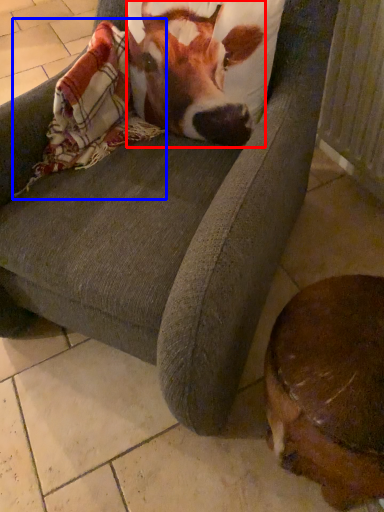
Question: Which object appears farthest to the camera in this image, cattle (highlighted by a red box) or blanket (highlighted by a blue box)?

Choices:
 (A) cattle
 (B) blanket

Answer: (B)